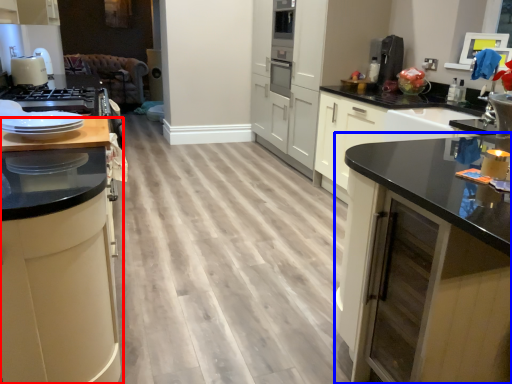
Question: Which of the following is the closest to the observer, cabinetry (highlighted by a red box) or cabinetry (highlighted by a blue box)?

Choices:
 (A) cabinetry
 (B) cabinetry

Answer: (B)